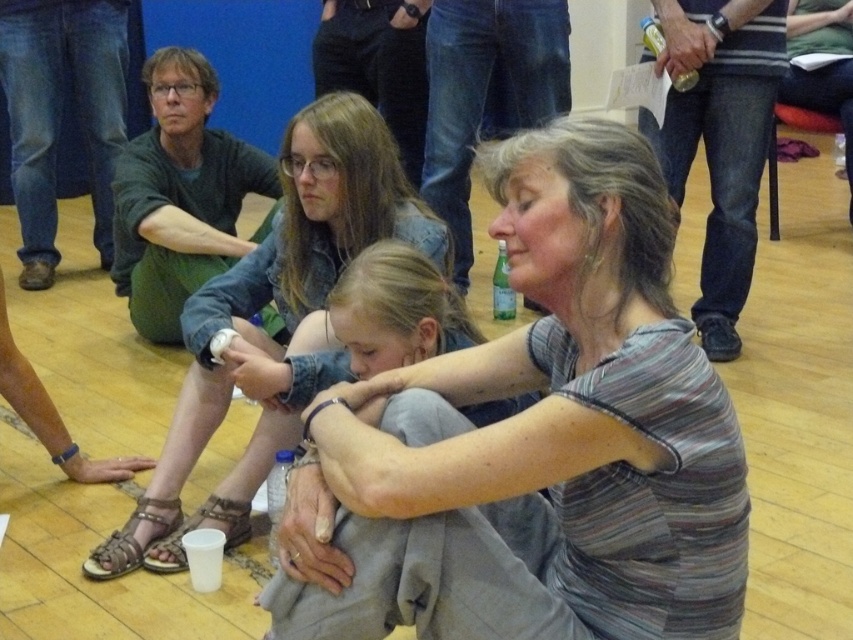
Question: Among these objects, which one is farthest from the camera?

Choices:
 (A) striped cotton shirt at center
 (B) matte denim jacket at center
 (C) denim jeans at center

Answer: (B)

Question: Is the position of striped cotton shirt at center less distant than that of matte denim jacket at center?

Choices:
 (A) no
 (B) yes

Answer: (B)

Question: Which point appears closest to the camera in this image?

Choices:
 (A) (552, 413)
 (B) (282, 413)

Answer: (A)

Question: Among these points, which one is nearest to the camera?

Choices:
 (A) (577, 240)
 (B) (426, 333)

Answer: (A)

Question: Is the position of striped cotton shirt at center less distant than that of matte denim jacket at center?

Choices:
 (A) no
 (B) yes

Answer: (B)

Question: In this image, where is striped cotton shirt at center located relative to denim jeans at center?

Choices:
 (A) above
 (B) below

Answer: (B)